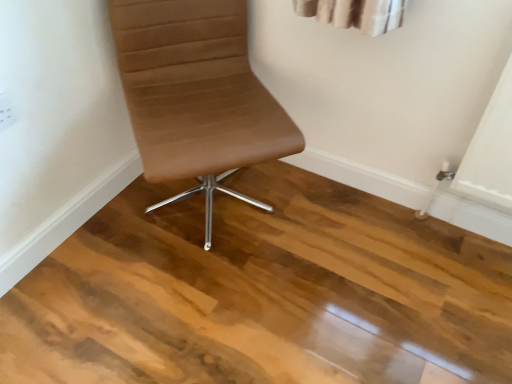
Question: Should I look upward or downward to see brown leather chair at center?

Choices:
 (A) down
 (B) up

Answer: (B)